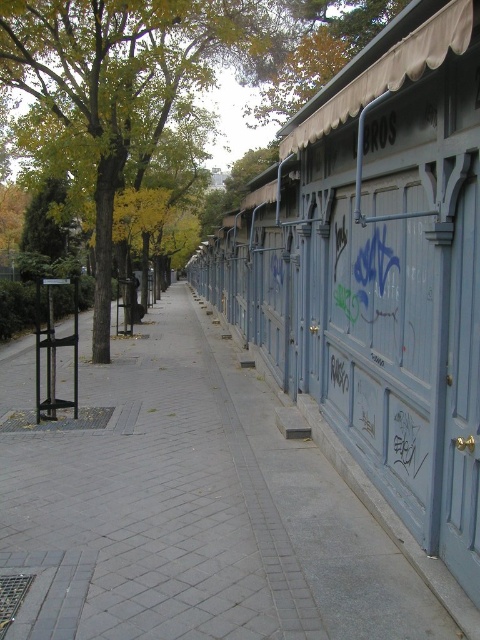
Can you confirm if gray brick pavement at center is positioned above green leafy tree at upper left?

Incorrect, gray brick pavement at center is not positioned above green leafy tree at upper left.

Between point (275, 580) and point (108, 344), which one is positioned in front?

Positioned in front is point (275, 580).

Find the location of a particular element. The height and width of the screenshot is (640, 480). gray brick pavement at center is located at coordinates (189, 506).

What do you see at coordinates (377, 269) in the screenshot?
I see `blue painted wood shed at right` at bounding box center [377, 269].

Can you confirm if blue painted wood shed at right is bigger than green leafy tree at upper left?

Actually, blue painted wood shed at right might be smaller than green leafy tree at upper left.

Which is behind, point (476, 252) or point (79, 22)?

Positioned behind is point (79, 22).

You are a GUI agent. You are given a task and a screenshot of the screen. Output one action in this format:
    pyautogui.click(x=<x>, y=<y>)
    Task: Click on the blue painted wood shed at right
    The width and height of the screenshot is (480, 640).
    Given the screenshot: What is the action you would take?
    pyautogui.click(x=377, y=269)

Does gray brick pavement at center have a greater width compared to blue painted wood shed at right?

Correct, the width of gray brick pavement at center exceeds that of blue painted wood shed at right.

Is gray brick pavement at center closer to camera compared to blue painted wood shed at right?

No, gray brick pavement at center is further to the viewer.

Identify the location of gray brick pavement at center. This screenshot has height=640, width=480. (189, 506).